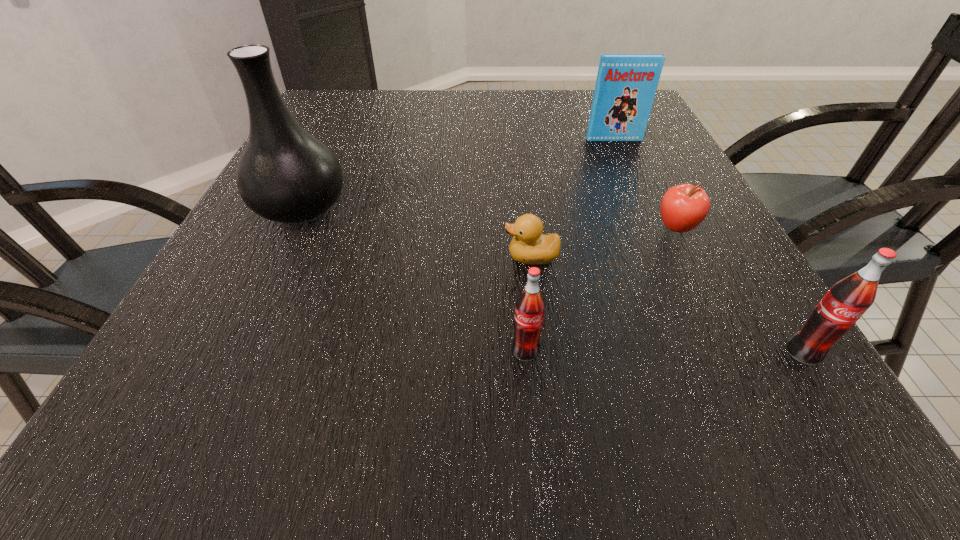
With all soda bottles evenly spaced, where should an extra soda bottle be placed on the left to continue the pattern? Please point out a vacant space. Please provide its 2D coordinates. Your answer should be formatted as a tuple, i.e. [(x, y)], where the tuple contains the x and y coordinates of a point satisfying the conditions above.

[(249, 349)]